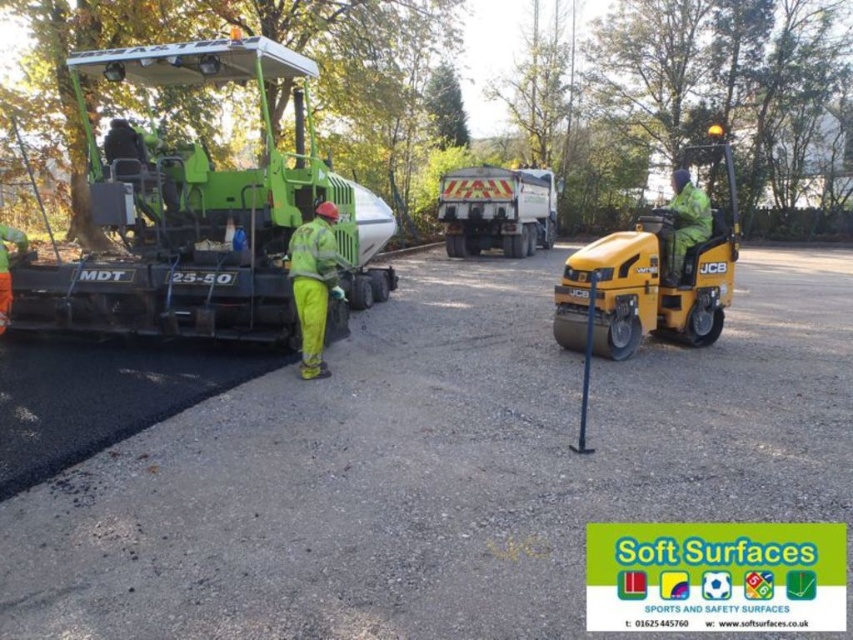
Question: Can you confirm if yellow reflective plastic truck at center is wider than yellow reflective safety suit at center?

Choices:
 (A) yes
 (B) no

Answer: (A)

Question: Which object is closer to the camera taking this photo?

Choices:
 (A) yellow reflective plastic truck at center
 (B) yellow rubber jcb at right
 (C) green rubberized asphalt paver at left
 (D) yellow reflective safety suit at center

Answer: (D)

Question: Where is green rubberized asphalt paver at left located in relation to yellow rubber jcb at right in the image?

Choices:
 (A) right
 (B) left

Answer: (B)

Question: Which object is positioned closest to the yellow rubber jcb at right?

Choices:
 (A) yellow reflective safety suit at center
 (B) green rubberized asphalt paver at left

Answer: (A)

Question: Which point is closer to the camera?

Choices:
 (A) (200, 67)
 (B) (473, 230)
 (C) (709, 253)
 (D) (310, 262)

Answer: (D)

Question: Is green rubberized asphalt paver at left thinner than yellow reflective plastic truck at center?

Choices:
 (A) yes
 (B) no

Answer: (A)